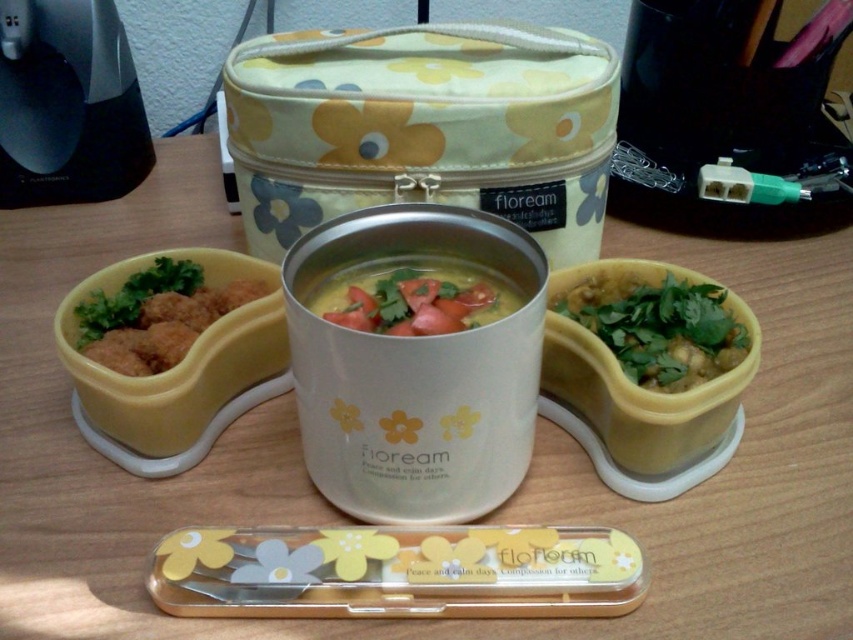
Does brown matte chicken nuggets at left have a lesser width compared to yellow matte soup at center?

In fact, brown matte chicken nuggets at left might be wider than yellow matte soup at center.

Does brown matte chicken nuggets at left have a greater width compared to yellow matte soup at center?

Yes.

Is point (196, 264) in front of point (434, 292)?

No, (196, 264) is behind (434, 292).

You are a GUI agent. You are given a task and a screenshot of the screen. Output one action in this format:
    pyautogui.click(x=<x>, y=<y>)
    Task: Click on the brown matte chicken nuggets at left
    
    Given the screenshot: What is the action you would take?
    pyautogui.click(x=155, y=316)

Measure the distance from green leafy garnish at center to yellow matte soup at center.

5.76 inches

Is point (660, 291) less distant than point (466, 288)?

That is False.

Which is behind, point (582, 291) or point (460, 289)?

Positioned behind is point (582, 291).

Identify the location of green leafy garnish at center. This screenshot has height=640, width=853. (659, 323).

Does point (703, 317) come closer to viewer compared to point (115, 304)?

Yes, point (703, 317) is in front of point (115, 304).

Is green leafy garnish at center closer to camera compared to brown matte chicken nuggets at left?

Yes, green leafy garnish at center is in front of brown matte chicken nuggets at left.

Between point (634, 371) and point (200, 292), which one is positioned behind?

Positioned behind is point (200, 292).

Find the location of a particular element. The height and width of the screenshot is (640, 853). green leafy garnish at center is located at coordinates (659, 323).